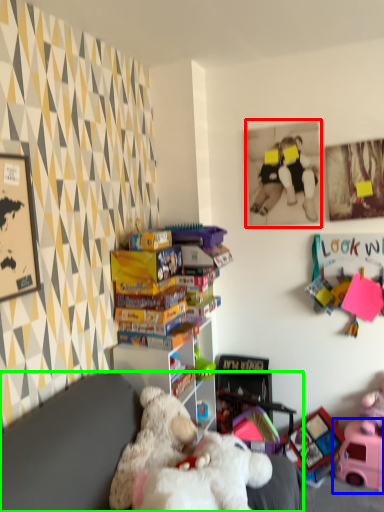
Question: Based on their relative distances, which object is nearer to picture frame (highlighted by a red box)? Choose from toy (highlighted by a blue box) and furniture (highlighted by a green box).

Choices:
 (A) toy
 (B) furniture

Answer: (A)